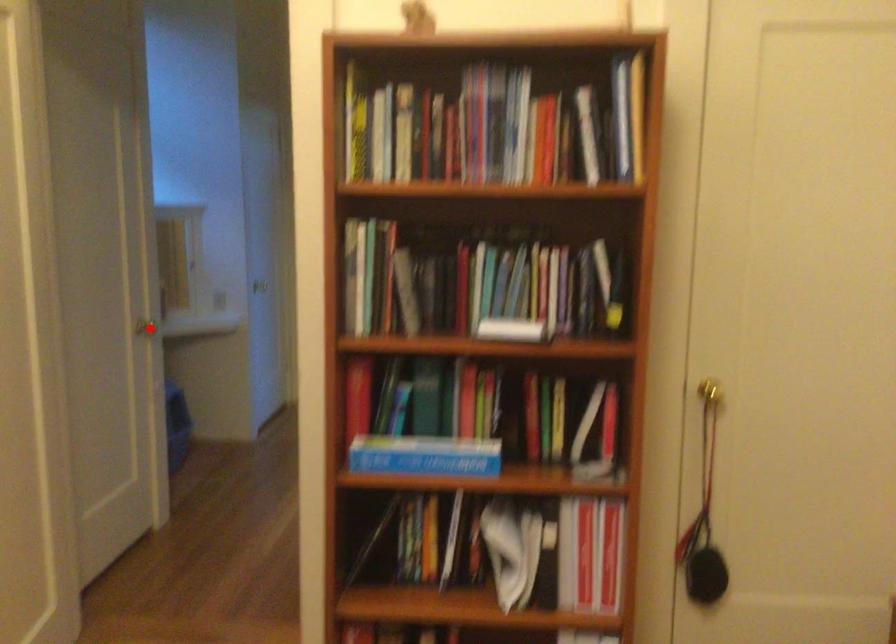
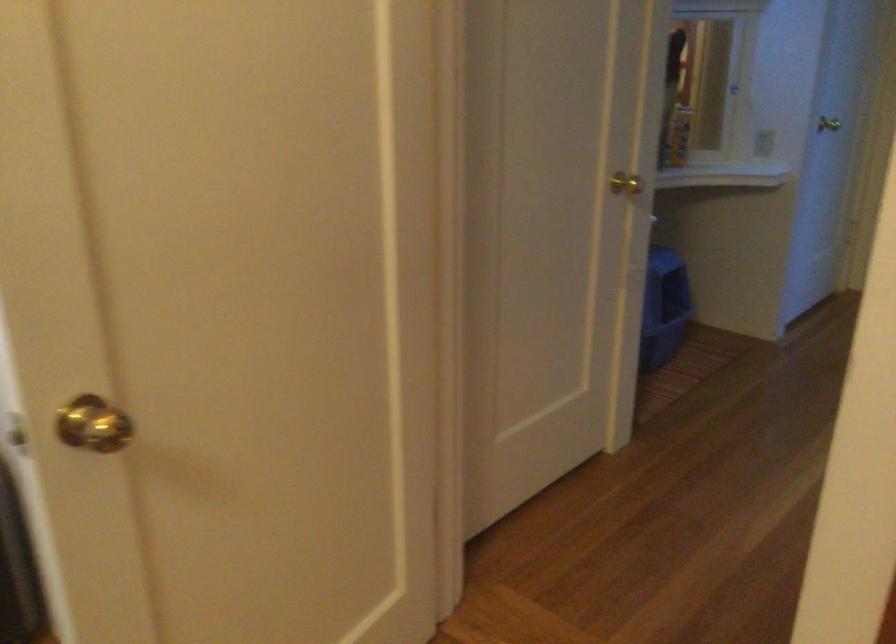
Question: I am providing you with two images of the same scene from different viewpoints. A red point is marked on the first image. Is the red point's position out of view in image 2?

Choices:
 (A) Yes
 (B) No

Answer: (B)